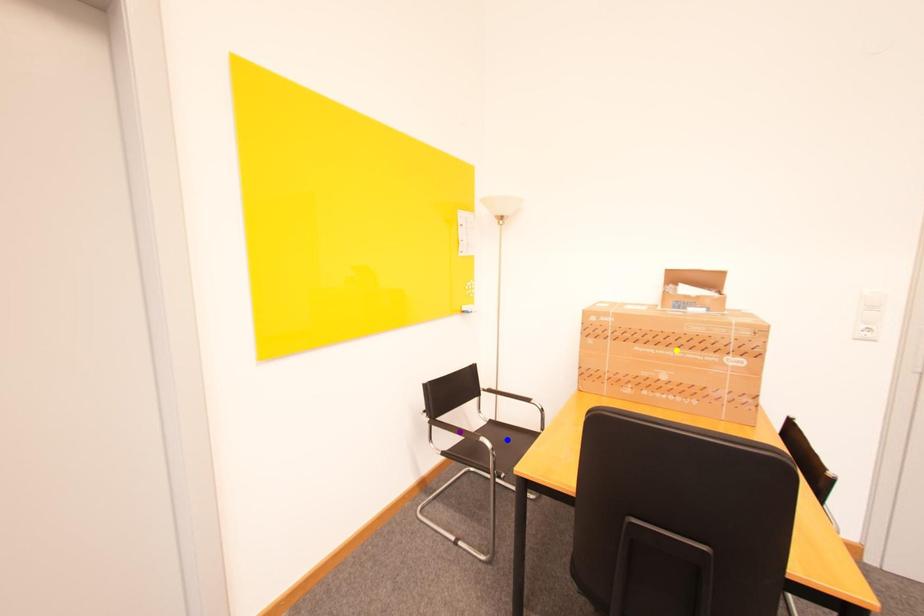
Order these from nearest to farthest:
- purple point
- yellow point
- blue point

purple point → blue point → yellow point